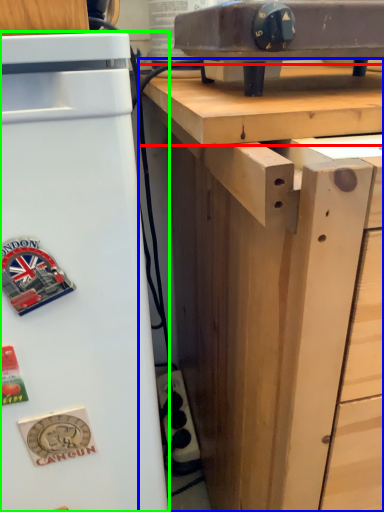
Question: Which object is positioned farthest from wood (highlighted by a red box)? Select from desk (highlighted by a blue box) and refrigerator (highlighted by a green box).

Choices:
 (A) desk
 (B) refrigerator

Answer: (B)